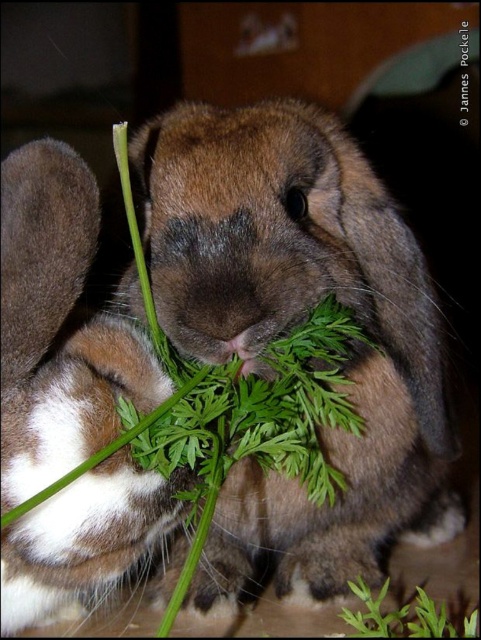
Consider the image. Who is lower down, brown fur rabbit at center or brown fur rabbit at left?

Positioned lower is brown fur rabbit at left.

The width and height of the screenshot is (481, 640). What do you see at coordinates (296, 323) in the screenshot?
I see `brown fur rabbit at center` at bounding box center [296, 323].

Locate an element on the screen. This screenshot has width=481, height=640. brown fur rabbit at center is located at coordinates (296, 323).

Can you confirm if brown fur rabbit at left is positioned above green leafy plant at lower right?

Indeed, brown fur rabbit at left is positioned over green leafy plant at lower right.

Is brown fur rabbit at left to the right of green leafy plant at lower right from the viewer's perspective?

No, brown fur rabbit at left is not to the right of green leafy plant at lower right.

Locate an element on the screen. This screenshot has height=640, width=481. brown fur rabbit at left is located at coordinates (59, 326).

Locate an element on the screen. The height and width of the screenshot is (640, 481). brown fur rabbit at left is located at coordinates (59, 326).

Looking at this image, between brown fur rabbit at center and green leafy plant at lower right, which one is positioned higher?

brown fur rabbit at center

Does brown fur rabbit at center appear under green leafy plant at lower right?

No, brown fur rabbit at center is not below green leafy plant at lower right.

Identify the location of brown fur rabbit at center. The image size is (481, 640). (296, 323).